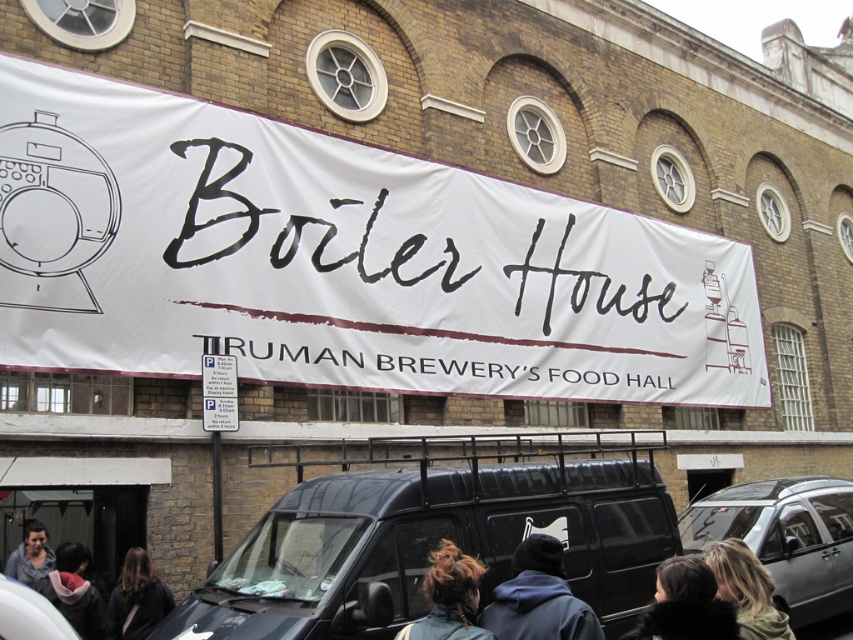
You are a photographer standing in front of the Boiler House building. You notice a black fur coat at lower center and a blonde hair at lower right. Which object is smaller in size?

The black fur coat at lower center is smaller in size compared to the blonde hair at lower right.

You are a photographer standing in front of the Boiler House building. You want to take a photo that includes both the black fur coat at lower center and the blonde hair at lower right. Do you think you can fit both in the frame if your camera has a 1.5 meter wide field of view?

The black fur coat at lower center and the blonde hair at lower right are 1.78 meters apart. Since the distance between them exceeds the camera field of view of 1.5 meters, you cannot fit both in the frame.